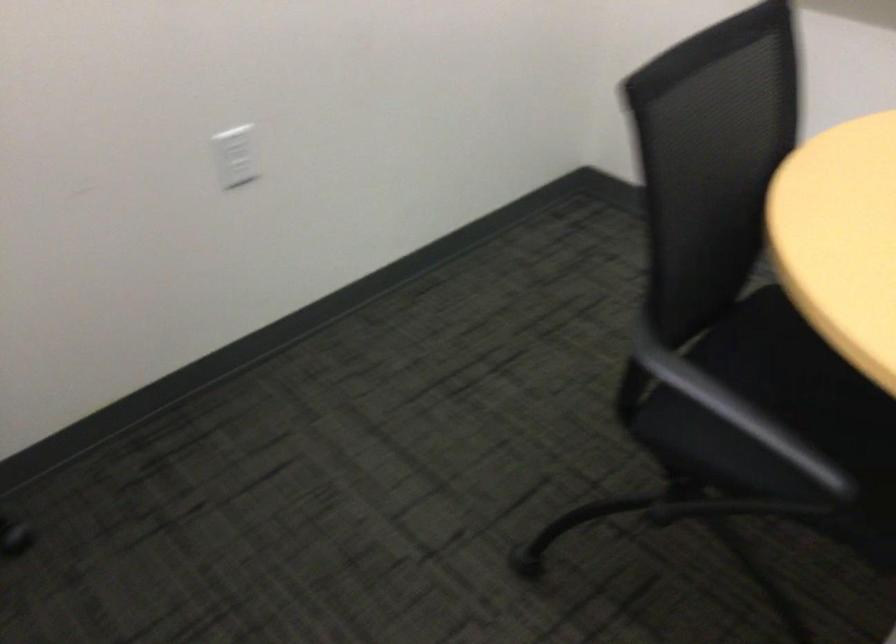
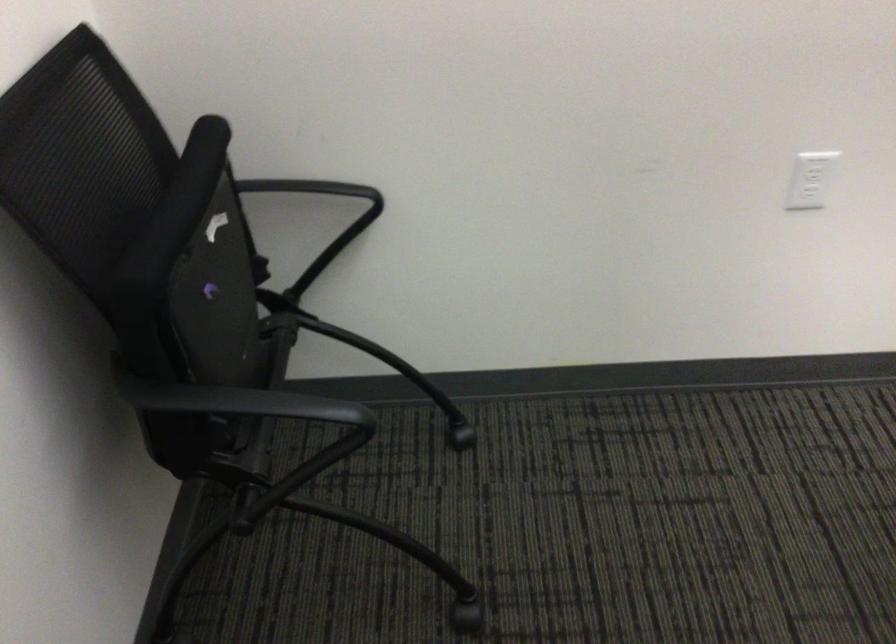
Find the pixel in the second image that matches (x=247, y=160) in the first image.

(810, 180)